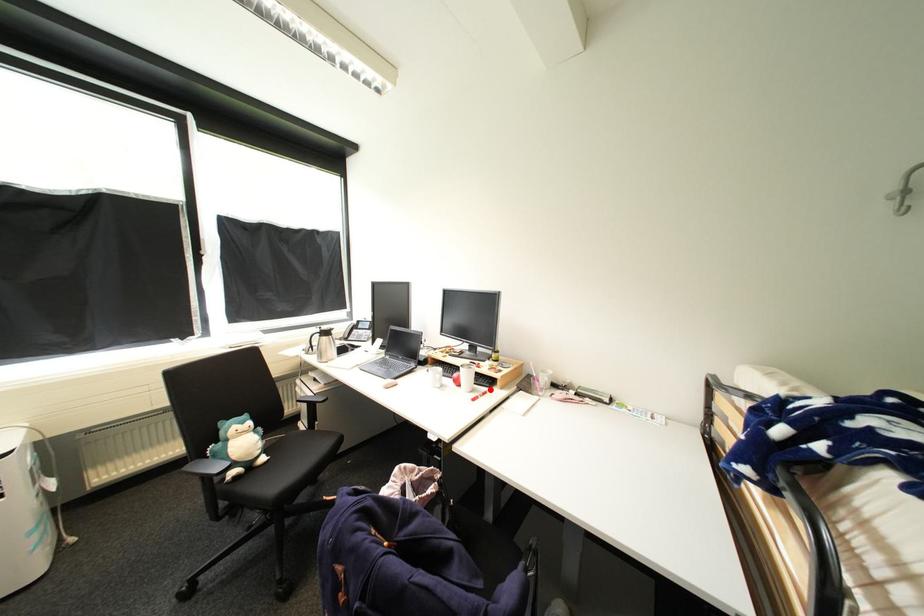
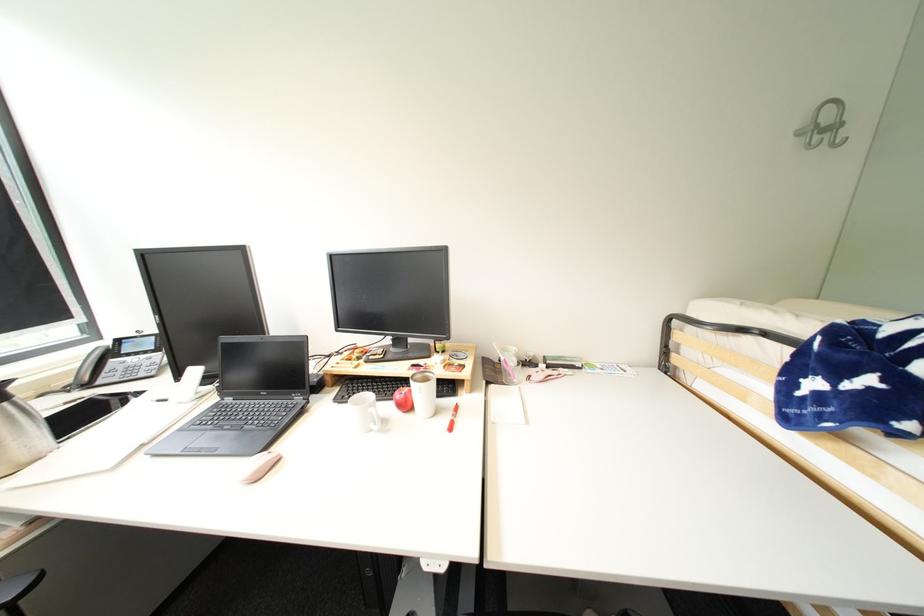
Where in the second image is the point corresponding to the highlighted location from the first image?

(456, 402)